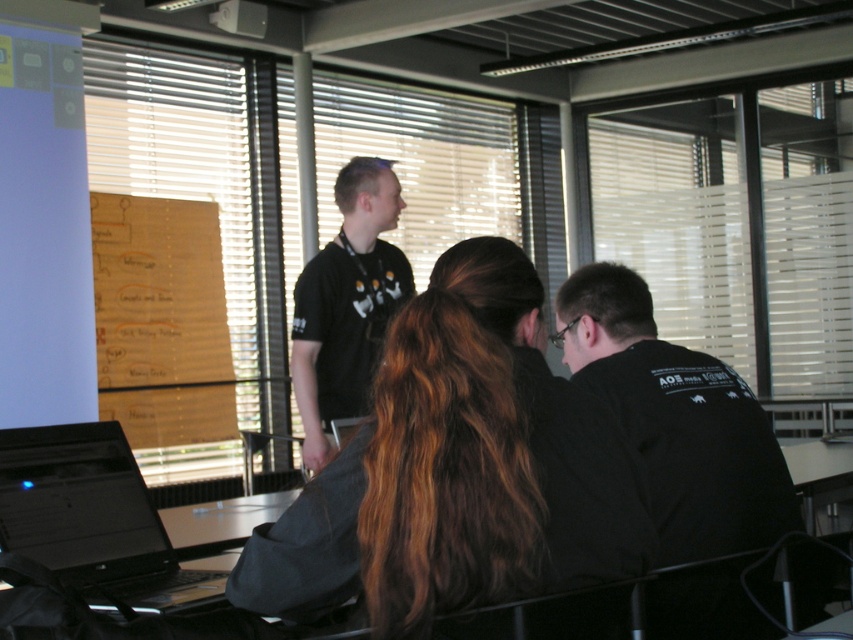
Question: Does black matte shirt at center have a smaller size compared to white plastic projector at upper center?

Choices:
 (A) no
 (B) yes

Answer: (A)

Question: Which is farther from the matte white projector screen at upper left?

Choices:
 (A) black matte shirt at right
 (B) white plastic projector at upper center
 (C) brown wavy hair at center

Answer: (C)

Question: Can you confirm if matte white projector screen at upper left is wider than black matte shirt at center?

Choices:
 (A) no
 (B) yes

Answer: (B)

Question: Which point is closer to the camera taking this photo?

Choices:
 (A) (103, 122)
 (B) (757, 509)
 (C) (84, 570)
 (D) (80, 113)

Answer: (B)

Question: Which object is the closest to the wooden board at upper left?

Choices:
 (A) black matte shirt at right
 (B) brown wavy hair at center
 (C) white plastic projector at upper center
 (D) black matte laptop at lower left

Answer: (C)

Question: Is matte white projector screen at upper left closer to the viewer compared to black matte laptop at lower left?

Choices:
 (A) yes
 (B) no

Answer: (B)